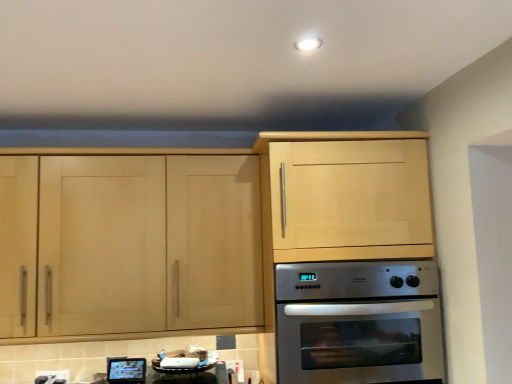
Question: Considering the relative sizes of stainless steel oven at lower center and metallic silver tv at lower left in the image provided, is stainless steel oven at lower center smaller than metallic silver tv at lower left?

Choices:
 (A) yes
 (B) no

Answer: (B)

Question: Is stainless steel oven at lower center located outside metallic silver tv at lower left?

Choices:
 (A) no
 (B) yes

Answer: (B)

Question: Is the depth of stainless steel oven at lower center less than that of metallic silver tv at lower left?

Choices:
 (A) yes
 (B) no

Answer: (A)

Question: Does stainless steel oven at lower center come behind metallic silver tv at lower left?

Choices:
 (A) yes
 (B) no

Answer: (B)

Question: From a real-world perspective, does stainless steel oven at lower center sit lower than metallic silver tv at lower left?

Choices:
 (A) no
 (B) yes

Answer: (A)

Question: Considering the relative sizes of stainless steel oven at lower center and metallic silver tv at lower left in the image provided, is stainless steel oven at lower center thinner than metallic silver tv at lower left?

Choices:
 (A) yes
 (B) no

Answer: (B)

Question: Is metallic silver tv at lower left thinner than light wood cabinet at left?

Choices:
 (A) no
 (B) yes

Answer: (B)

Question: From the image's perspective, is metallic silver tv at lower left above light wood cabinet at left?

Choices:
 (A) yes
 (B) no

Answer: (B)

Question: Can you confirm if metallic silver tv at lower left is wider than light wood cabinet at left?

Choices:
 (A) yes
 (B) no

Answer: (B)

Question: Does metallic silver tv at lower left turn towards light wood cabinet at left?

Choices:
 (A) yes
 (B) no

Answer: (B)

Question: Is light wood cabinet at left at the back of metallic silver tv at lower left?

Choices:
 (A) no
 (B) yes

Answer: (A)

Question: Does metallic silver tv at lower left come behind light wood cabinet at left?

Choices:
 (A) no
 (B) yes

Answer: (B)

Question: Considering the relative sizes of metallic silver tv at lower left and stainless steel oven at lower center in the image provided, is metallic silver tv at lower left bigger than stainless steel oven at lower center?

Choices:
 (A) no
 (B) yes

Answer: (A)